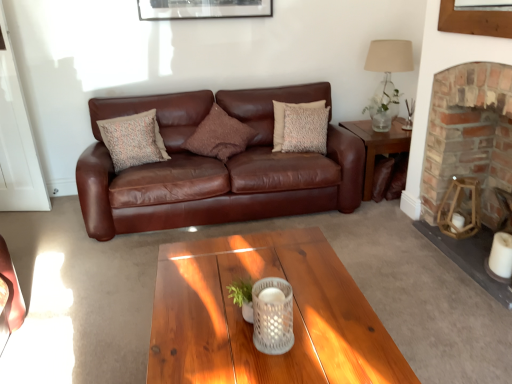
Question: Is point coord(139,137) positioned closer to the camera than point coord(389,97)?

Choices:
 (A) farther
 (B) closer

Answer: (B)

Question: Considering their positions, is textured beige pillow at center, positioned as the third pillow in right-to-left order, located in front of or behind translucent glass lamp at upper right?

Choices:
 (A) front
 (B) behind

Answer: (A)

Question: Considering the real-world distances, which object is closest to the brown textured pillow at center, positioned as the second pillow in right-to-left order?

Choices:
 (A) metallic silver picture frame at upper center
 (B) translucent glass lamp at upper right
 (C) brown leather couch at center
 (D) beige textured pillow at center, placed as the third pillow when sorted from left to right
 (E) wooden side table at right

Answer: (C)

Question: Based on their relative distances, which object is farther from the beige textured pillow at center, which is the 1th pillow in right-to-left order?

Choices:
 (A) textured beige pillow at center, placed as the 1th pillow when sorted from left to right
 (B) translucent glass lamp at upper right
 (C) brick fireplace at right
 (D) brown leather couch at center
 (E) wooden side table at right

Answer: (C)